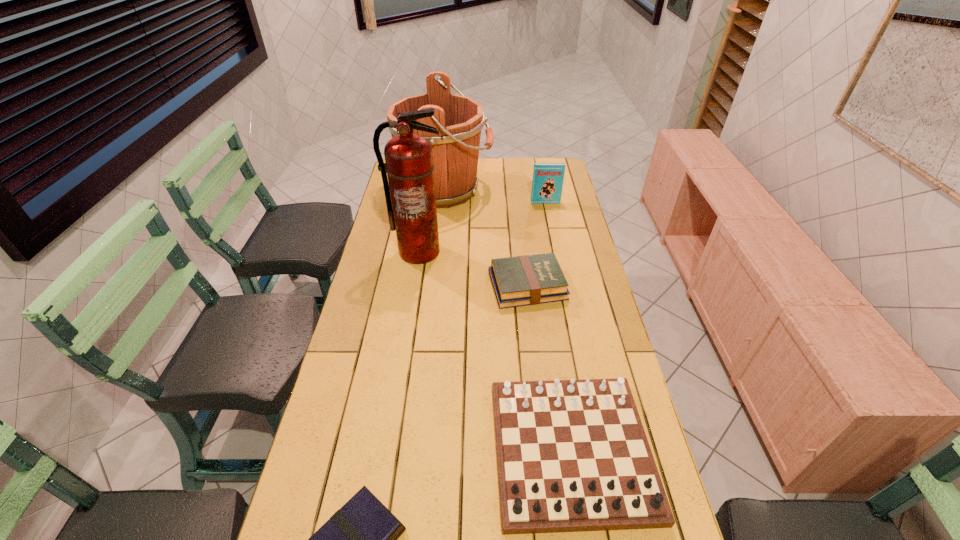
Where is `free space located 0.280m on the back of the chessboard`? Image resolution: width=960 pixels, height=540 pixels. free space located 0.280m on the back of the chessboard is located at coordinates (549, 310).

Where is `vacant space situated on the front of the second shortest book`? The image size is (960, 540). vacant space situated on the front of the second shortest book is located at coordinates (534, 343).

The height and width of the screenshot is (540, 960). Identify the location of object at the far edge. (459, 120).

Image resolution: width=960 pixels, height=540 pixels. Find the location of `fire extinguisher located in the left edge section of the desktop`. fire extinguisher located in the left edge section of the desktop is located at coordinates (411, 201).

Image resolution: width=960 pixels, height=540 pixels. Find the location of `bucket at the left edge`. bucket at the left edge is located at coordinates (459, 120).

Locate an element on the screen. chessboard that is at the right edge is located at coordinates 572,455.

Locate an element on the screen. The image size is (960, 540). object that is at the far left corner is located at coordinates (459, 120).

The width and height of the screenshot is (960, 540). I want to click on vacant space at the left edge, so click(381, 254).

You are a GUI agent. You are given a task and a screenshot of the screen. Output one action in this format:
    pyautogui.click(x=<x>, y=<y>)
    Task: Click on the free location at the right edge
    
    Given the screenshot: What is the action you would take?
    pyautogui.click(x=559, y=328)

Where is `vacant space that is in between the chessboard and the farthest book`? The height and width of the screenshot is (540, 960). vacant space that is in between the chessboard and the farthest book is located at coordinates pos(559,326).